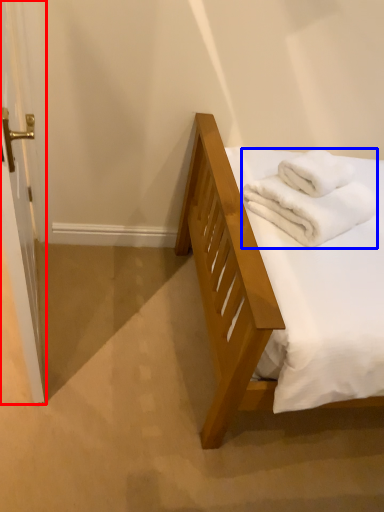
Question: Among these objects, which one is nearest to the camera, screen door (highlighted by a red box) or bath towel (highlighted by a blue box)?

Choices:
 (A) screen door
 (B) bath towel

Answer: (A)